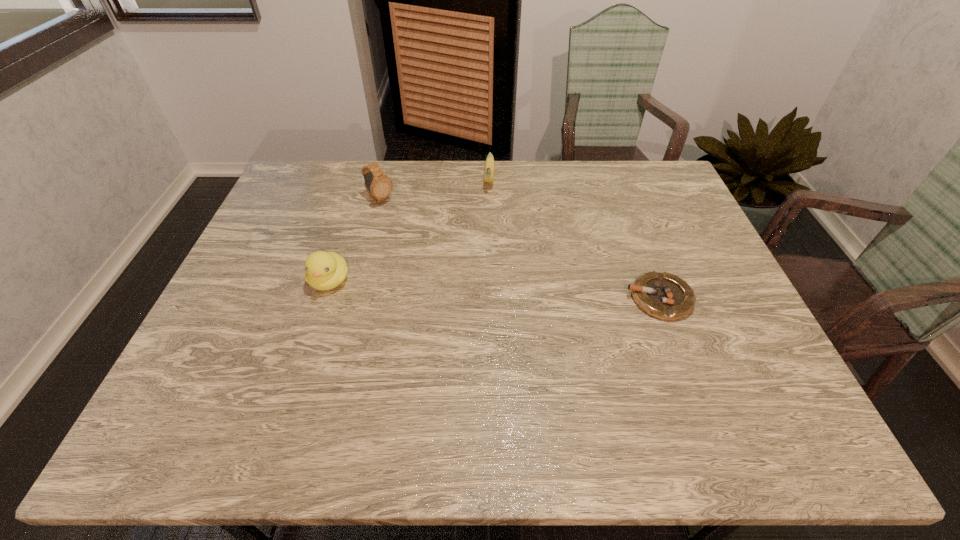
Find the location of a particular element. This screenshot has height=540, width=960. free location at the right edge is located at coordinates (681, 260).

The image size is (960, 540). Find the location of `free location at the far right corner of the desktop`. free location at the far right corner of the desktop is located at coordinates (648, 167).

Where is `vacant space at the near right corner of the desktop`? This screenshot has width=960, height=540. vacant space at the near right corner of the desktop is located at coordinates (771, 380).

Where is `free spot between the shortest object and the watch`? Image resolution: width=960 pixels, height=540 pixels. free spot between the shortest object and the watch is located at coordinates (519, 249).

What are the coordinates of `free area in between the watch and the duckling` in the screenshot? It's located at (355, 240).

Where is `free space between the third tallest object and the duckling`? free space between the third tallest object and the duckling is located at coordinates (409, 230).

In order to click on free area in between the watch and the duckling in this screenshot , I will do `click(355, 240)`.

I want to click on free point between the watch and the second shortest object, so pyautogui.click(x=435, y=190).

You are a GUI agent. You are given a task and a screenshot of the screen. Output one action in this format:
    pyautogui.click(x=<x>, y=<y>)
    Task: Click on the unoccupied position between the banana and the duckling
    
    Given the screenshot: What is the action you would take?
    pyautogui.click(x=409, y=230)

Locate an element on the screen. empty space that is in between the watch and the third tallest object is located at coordinates (435, 190).